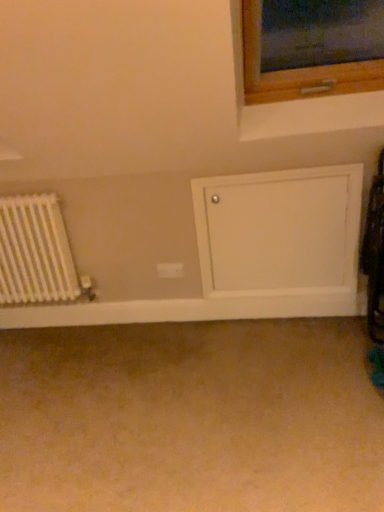
Identify the location of beige carpet at lower center. (191, 418).

The image size is (384, 512). What do you see at coordinates (35, 252) in the screenshot?
I see `white matte radiator at left` at bounding box center [35, 252].

The image size is (384, 512). What are the coordinates of `beige carpet at lower center` in the screenshot? It's located at (191, 418).

In the image, there is a white matte radiator at left. Identify the location of shelf below it (from a real-world perspective). (281, 236).

Can white matte radiator at left be found inside white painted wood door at lower right?

No, white matte radiator at left is not surrounded by white painted wood door at lower right.

Based on the photo, measure the distance between white painted wood door at lower right and white matte radiator at left.

white painted wood door at lower right and white matte radiator at left are 1.01 meters apart.

Does white painted wood door at lower right lie behind white matte radiator at left?

No, it is in front of white matte radiator at left.

Considering the relative sizes of beige carpet at lower center and white plastic electric outlet at center in the image provided, is beige carpet at lower center bigger than white plastic electric outlet at center?

Correct, beige carpet at lower center is larger in size than white plastic electric outlet at center.

Does beige carpet at lower center touch white plastic electric outlet at center?

No, beige carpet at lower center is not touching white plastic electric outlet at center.

Is beige carpet at lower center thinner than white plastic electric outlet at center?

No, beige carpet at lower center is not thinner than white plastic electric outlet at center.

Consider the image. Is beige carpet at lower center closer to the viewer compared to white plastic electric outlet at center?

Yes.

From the picture: Is white painted wood door at lower right at the back of beige carpet at lower center?

No, beige carpet at lower center is not facing the opposite direction of white painted wood door at lower right.

Is the depth of beige carpet at lower center greater than that of white painted wood door at lower right?

That is False.

How far apart are beige carpet at lower center and white painted wood door at lower right?

The distance of beige carpet at lower center from white painted wood door at lower right is 24.79 inches.

Find the location of a particular element. The image size is (384, 512). plain below the white painted wood door at lower right (from a real-world perspective) is located at coordinates (191, 418).

From a real-world perspective, does white plastic electric outlet at center stand above beige carpet at lower center?

Yes, from a real-world perspective, white plastic electric outlet at center is on top of beige carpet at lower center.

The height and width of the screenshot is (512, 384). Identify the location of electric outlet that appears behind the beige carpet at lower center. (170, 270).

From the image's perspective, would you say white plastic electric outlet at center is shown under beige carpet at lower center?

No.

Does point (161, 276) appear closer or farther from the camera than point (198, 446)?

Clearly, point (161, 276) is more distant from the camera than point (198, 446).

Can you confirm if white matte radiator at left is taller than white plastic electric outlet at center?

Yes.

Could you tell me if white matte radiator at left is turned towards white plastic electric outlet at center?

No, white matte radiator at left is not aimed at white plastic electric outlet at center.

Considering the relative sizes of white matte radiator at left and white plastic electric outlet at center in the image provided, is white matte radiator at left bigger than white plastic electric outlet at center?

Yes.

From the picture: Is white plastic electric outlet at center completely or partially inside white matte radiator at left?

No, white plastic electric outlet at center is not surrounded by white matte radiator at left.

Which of these two, white plastic electric outlet at center or white painted wood door at lower right, stands shorter?

With less height is white plastic electric outlet at center.

There is a white plastic electric outlet at center. Where is `shelf above it (from a real-world perspective)`? This screenshot has width=384, height=512. shelf above it (from a real-world perspective) is located at coordinates (281, 236).

Which of these two, white plastic electric outlet at center or white painted wood door at lower right, is bigger?

Bigger between the two is white painted wood door at lower right.

Between white plastic electric outlet at center and white painted wood door at lower right, which one has smaller width?

white plastic electric outlet at center.

Would you consider white matte radiator at left to be distant from white painted wood door at lower right?

Absolutely, white matte radiator at left is distant from white painted wood door at lower right.

From the image's perspective, which one is positioned lower, white matte radiator at left or white painted wood door at lower right?

white matte radiator at left appears lower in the image.

Is white matte radiator at left situated inside white painted wood door at lower right or outside?

white matte radiator at left is located beyond the bounds of white painted wood door at lower right.

Is white matte radiator at left facing towards white painted wood door at lower right?

No, white matte radiator at left is not oriented towards white painted wood door at lower right.

Where is `radiator behind the white painted wood door at lower right`? The height and width of the screenshot is (512, 384). radiator behind the white painted wood door at lower right is located at coordinates (35, 252).

I want to click on electric outlet above the beige carpet at lower center (from the image's perspective), so click(x=170, y=270).

Considering their positions, is white plastic electric outlet at center positioned closer to white painted wood door at lower right than beige carpet at lower center?

Based on the image, white plastic electric outlet at center appears to be nearer to white painted wood door at lower right.

Based on their spatial positions, is white painted wood door at lower right or beige carpet at lower center closer to white plastic electric outlet at center?

white painted wood door at lower right.

When comparing their distances from white painted wood door at lower right, does beige carpet at lower center or white plastic electric outlet at center seem closer?

white plastic electric outlet at center is positioned closer to the anchor white painted wood door at lower right.

Considering their positions, is white painted wood door at lower right positioned closer to beige carpet at lower center than white matte radiator at left?

The object closer to beige carpet at lower center is white painted wood door at lower right.

When comparing their distances from beige carpet at lower center, does white plastic electric outlet at center or white matte radiator at left seem further?

The object further to beige carpet at lower center is white plastic electric outlet at center.

Estimate the real-world distances between objects in this image. Which object is closer to white matte radiator at left, white painted wood door at lower right or white plastic electric outlet at center?

Based on the image, white plastic electric outlet at center appears to be nearer to white matte radiator at left.

From the image, which object appears to be farther from white plastic electric outlet at center, beige carpet at lower center or white matte radiator at left?

beige carpet at lower center is further to white plastic electric outlet at center.

From the image, which object appears to be farther from white matte radiator at left, beige carpet at lower center or white painted wood door at lower right?

white painted wood door at lower right is further to white matte radiator at left.

This screenshot has width=384, height=512. I want to click on radiator located between beige carpet at lower center and white plastic electric outlet at center in the depth direction, so click(x=35, y=252).

Where is `shelf between beige carpet at lower center and white plastic electric outlet at center in the front-back direction`? shelf between beige carpet at lower center and white plastic electric outlet at center in the front-back direction is located at coordinates (281, 236).

Where is `electric outlet between white matte radiator at left and white painted wood door at lower right in the horizontal direction`? This screenshot has height=512, width=384. electric outlet between white matte radiator at left and white painted wood door at lower right in the horizontal direction is located at coordinates (170, 270).

Locate an element on the screen. Image resolution: width=384 pixels, height=512 pixels. plain between white matte radiator at left and white painted wood door at lower right in the horizontal direction is located at coordinates (191, 418).